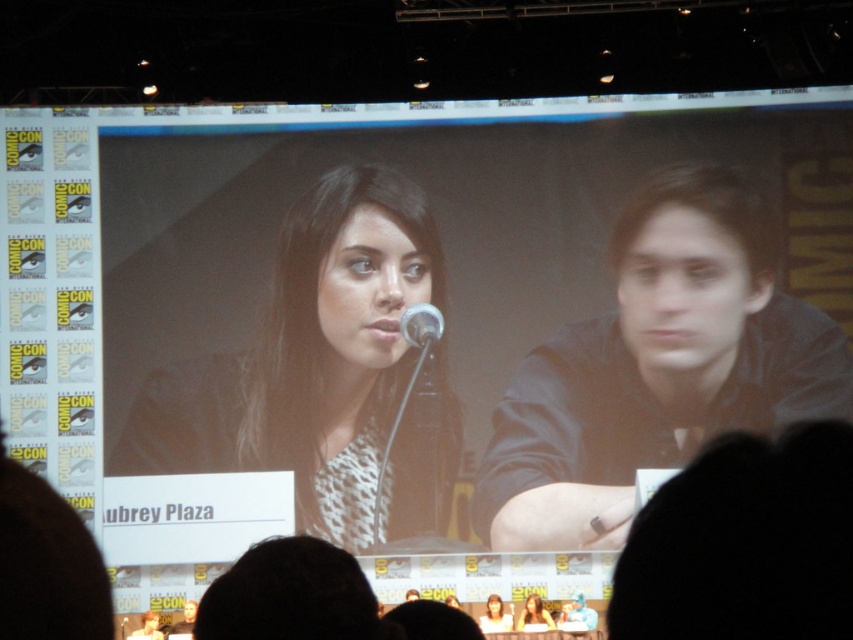
Is dark gray shirt at right to the right of matte white shirt at center from the viewer's perspective?

Indeed, dark gray shirt at right is positioned on the right side of matte white shirt at center.

Is dark gray shirt at right shorter than matte white shirt at center?

No.

Does point (682, 388) lie in front of point (505, 618)?

No, (682, 388) is further to viewer.

This screenshot has height=640, width=853. Find the location of `dark gray shirt at right`. dark gray shirt at right is located at coordinates (657, 365).

Does dark gray shirt at right appear under matte black dress at center?

No, dark gray shirt at right is not below matte black dress at center.

Does point (618, 292) lie behind point (526, 604)?

Yes.

Where is `dark gray shirt at right`? Image resolution: width=853 pixels, height=640 pixels. dark gray shirt at right is located at coordinates (657, 365).

Which is behind, point (595, 490) or point (444, 353)?

Point (444, 353)

You are a GUI agent. You are given a task and a screenshot of the screen. Output one action in this format:
    pyautogui.click(x=<x>, y=<y>)
    Task: Click on the dark gray shirt at right
    The height and width of the screenshot is (640, 853).
    Given the screenshot: What is the action you would take?
    pyautogui.click(x=657, y=365)

Identify the location of dark gray shirt at right. (657, 365).

Locate an element on the screen. This screenshot has width=853, height=640. dark gray shirt at right is located at coordinates (657, 365).